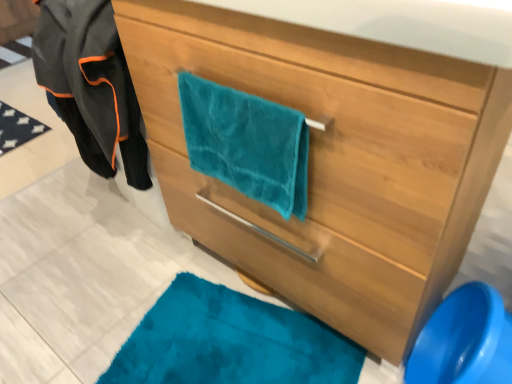
Question: Is the depth of teal fabric at lower right less than that of velvet black jacket at left?

Choices:
 (A) yes
 (B) no

Answer: (A)

Question: Is teal fabric at lower right further to camera compared to velvet black jacket at left?

Choices:
 (A) no
 (B) yes

Answer: (A)

Question: Is teal fabric at lower right wider than velvet black jacket at left?

Choices:
 (A) yes
 (B) no

Answer: (B)

Question: Is teal fabric at lower right at the right side of velvet black jacket at left?

Choices:
 (A) no
 (B) yes

Answer: (B)

Question: Is teal fabric at lower right bigger than velvet black jacket at left?

Choices:
 (A) yes
 (B) no

Answer: (A)

Question: Is teal fabric at lower right smaller than velvet black jacket at left?

Choices:
 (A) yes
 (B) no

Answer: (B)

Question: Considering the relative sizes of teal fabric towel at center and teal fabric at lower right in the image provided, is teal fabric towel at center bigger than teal fabric at lower right?

Choices:
 (A) no
 (B) yes

Answer: (B)

Question: Does teal fabric towel at center appear on the left side of teal fabric at lower right?

Choices:
 (A) no
 (B) yes

Answer: (B)

Question: Are teal fabric towel at center and teal fabric at lower right making contact?

Choices:
 (A) no
 (B) yes

Answer: (A)

Question: Is teal fabric towel at center further to the viewer compared to teal fabric at lower right?

Choices:
 (A) no
 (B) yes

Answer: (A)

Question: Is teal fabric towel at center aimed at teal fabric at lower right?

Choices:
 (A) yes
 (B) no

Answer: (B)

Question: From the image's perspective, does teal fabric towel at center appear higher than teal fabric at lower right?

Choices:
 (A) no
 (B) yes

Answer: (B)

Question: Is teal fabric at lower right turned away from teal plush towel at center?

Choices:
 (A) no
 (B) yes

Answer: (A)